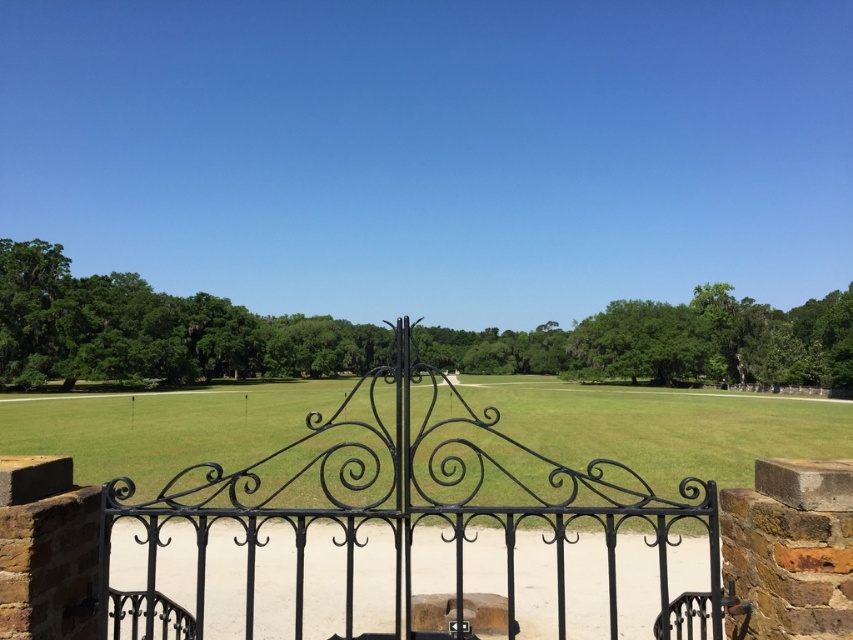
Based on the photo, you are standing in front of the black wrought iron gate at center and the green grass at center. Which object takes up less space in the scene?

The black wrought iron gate at center has a smaller size compared to the green grass at center, so it takes up less space in the scene.

You are standing at the entrance of a garden and see the black wrought iron gate at center. If you want to reach the gate, which direction should you move relative to your current position?

Since the black wrought iron gate at center is located at point 0.803 on the x axis and 0.476 on the y axis, you should move forward to reach it as it is positioned ahead of you in the scene.